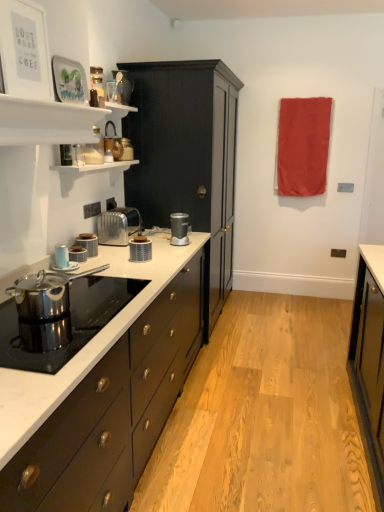
Question: In which direction should I rotate to look at satin silver blender at center, the 1th kitchen appliance when ordered from right to left?

Choices:
 (A) left
 (B) right

Answer: (A)

Question: Could you tell me if satin silver blender at center, the fifth kitchen appliance positioned from the front, is facing matte black cabinet at center?

Choices:
 (A) yes
 (B) no

Answer: (B)

Question: Can we say satin silver blender at center, acting as the fifth kitchen appliance starting from the left, lies outside matte black cabinet at center?

Choices:
 (A) no
 (B) yes

Answer: (B)

Question: From the image's perspective, would you say satin silver blender at center, the fifth kitchen appliance positioned from the front, is shown under matte black cabinet at center?

Choices:
 (A) yes
 (B) no

Answer: (A)

Question: Does satin silver blender at center, the fifth kitchen appliance positioned from the front, come behind matte black cabinet at center?

Choices:
 (A) yes
 (B) no

Answer: (B)

Question: Is satin silver blender at center, the 1th kitchen appliance viewed from the back, next to matte black cabinet at center?

Choices:
 (A) yes
 (B) no

Answer: (B)

Question: Considering the relative sizes of satin silver blender at center, the fifth kitchen appliance positioned from the front, and matte black cabinet at center in the image provided, is satin silver blender at center, the fifth kitchen appliance positioned from the front, taller than matte black cabinet at center?

Choices:
 (A) no
 (B) yes

Answer: (A)

Question: Can you confirm if white marble countertop at center is positioned to the right of matte black cabinet at center?

Choices:
 (A) yes
 (B) no

Answer: (B)

Question: Is white marble countertop at center wider than matte black cabinet at center?

Choices:
 (A) no
 (B) yes

Answer: (A)

Question: Does white marble countertop at center touch matte black cabinet at center?

Choices:
 (A) yes
 (B) no

Answer: (B)

Question: Considering the relative sizes of white marble countertop at center and matte black cabinet at center in the image provided, is white marble countertop at center thinner than matte black cabinet at center?

Choices:
 (A) yes
 (B) no

Answer: (A)

Question: Considering the relative sizes of white marble countertop at center and matte black cabinet at center in the image provided, is white marble countertop at center smaller than matte black cabinet at center?

Choices:
 (A) yes
 (B) no

Answer: (A)

Question: From a real-world perspective, is white marble countertop at center under matte black cabinet at center?

Choices:
 (A) no
 (B) yes

Answer: (B)

Question: Is the depth of satin silver toaster at center greater than that of metallic copper kettle at upper center, which appears as the 1th appliance when viewed from the back?

Choices:
 (A) no
 (B) yes

Answer: (A)